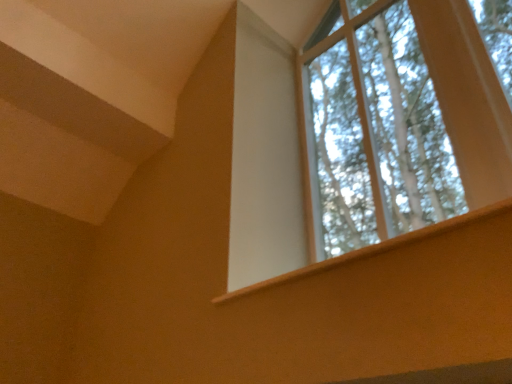
The height and width of the screenshot is (384, 512). I want to click on clear glass window at upper right, so click(371, 131).

What do you see at coordinates (371, 131) in the screenshot?
I see `clear glass window at upper right` at bounding box center [371, 131].

Locate an element on the screen. clear glass window at upper right is located at coordinates (371, 131).